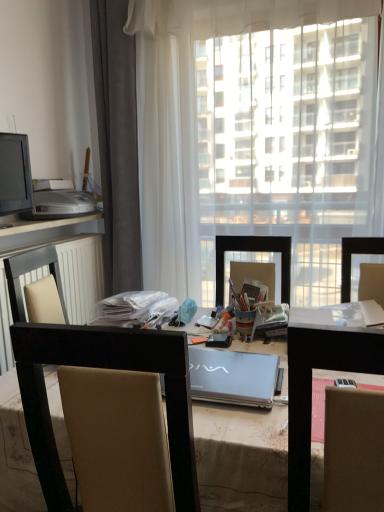
Question: Could beige fabric chair at center be considered to be inside transparent fabric at center?

Choices:
 (A) no
 (B) yes

Answer: (A)

Question: Is transparent fabric at center positioned beyond the bounds of beige fabric chair at center?

Choices:
 (A) yes
 (B) no

Answer: (A)

Question: Is transparent fabric at center aimed at beige fabric chair at center?

Choices:
 (A) no
 (B) yes

Answer: (B)

Question: Can you confirm if transparent fabric at center is positioned to the right of beige fabric chair at center?

Choices:
 (A) yes
 (B) no

Answer: (A)

Question: Does transparent fabric at center appear on the left side of beige fabric chair at center?

Choices:
 (A) yes
 (B) no

Answer: (B)

Question: From the image's perspective, would you say transparent fabric at center is positioned over beige fabric chair at center?

Choices:
 (A) yes
 (B) no

Answer: (A)

Question: Considering the relative sizes of matte black monitor at left and metallic silver laptop at center in the image provided, is matte black monitor at left wider than metallic silver laptop at center?

Choices:
 (A) no
 (B) yes

Answer: (A)

Question: Does matte black monitor at left have a greater height compared to metallic silver laptop at center?

Choices:
 (A) yes
 (B) no

Answer: (B)

Question: Is the position of matte black monitor at left more distant than that of metallic silver laptop at center?

Choices:
 (A) no
 (B) yes

Answer: (B)

Question: From the image's perspective, is matte black monitor at left over metallic silver laptop at center?

Choices:
 (A) yes
 (B) no

Answer: (A)

Question: Is matte black monitor at left facing away from metallic silver laptop at center?

Choices:
 (A) yes
 (B) no

Answer: (B)

Question: Would you say metallic silver laptop at center is part of matte black monitor at left's contents?

Choices:
 (A) yes
 (B) no

Answer: (B)

Question: Does transparent fabric at center have a larger size compared to metallic silver laptop at center?

Choices:
 (A) no
 (B) yes

Answer: (B)